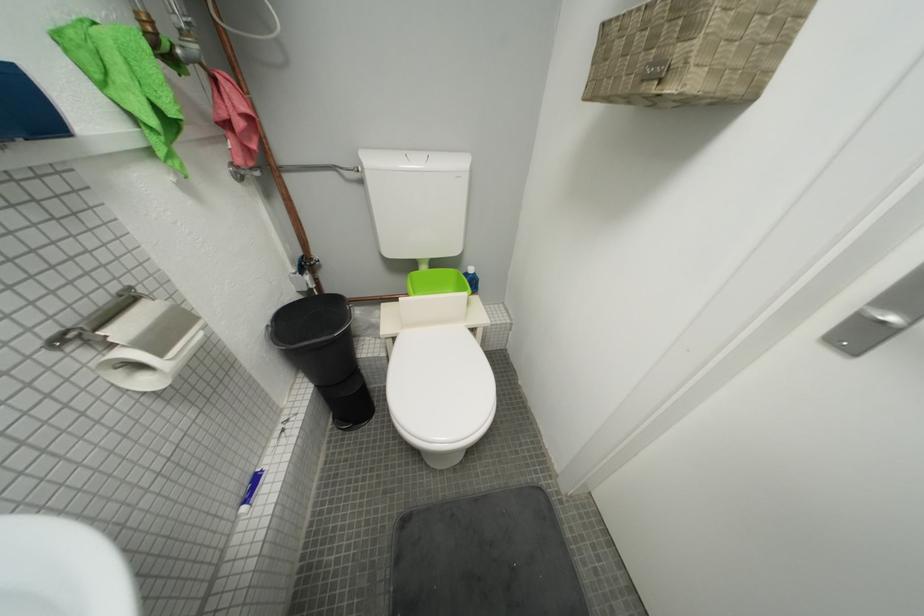
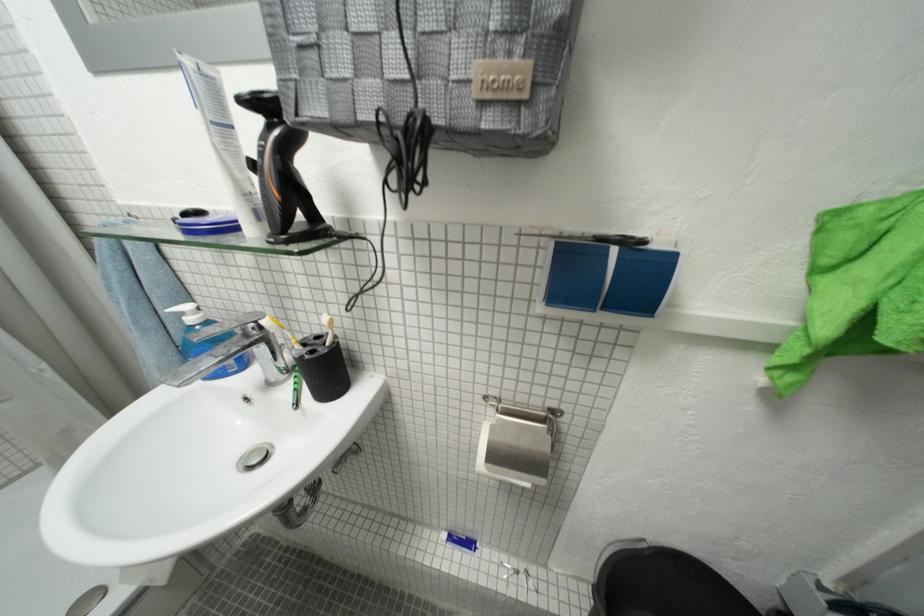
In the second image, find the point that corresponds to [251,512] in the first image.

(454, 538)